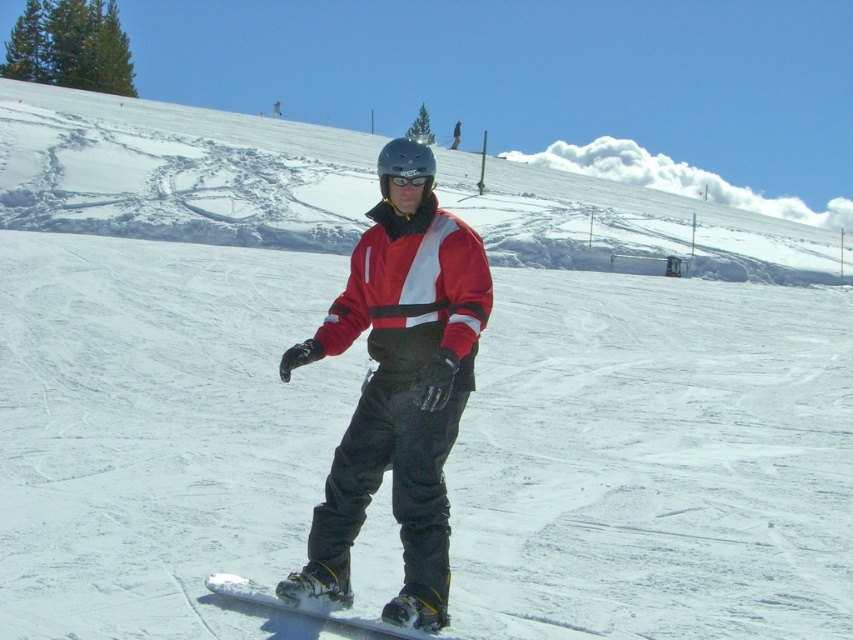
Question: Estimate the real-world distances between objects in this image. Which object is closer to the transparent plastic goggles at center?

Choices:
 (A) white matte snowboard at center
 (B) matte red snowboarder at center

Answer: (B)

Question: Which point is farther from the camera taking this photo?

Choices:
 (A) (392, 509)
 (B) (328, 605)
 (C) (427, 186)

Answer: (A)

Question: Where is matte red snowboarder at center located in relation to transparent plastic goggles at center in the image?

Choices:
 (A) below
 (B) above

Answer: (A)

Question: Considering the relative positions of matte red snowboarder at center and transparent plastic goggles at center in the image provided, where is matte red snowboarder at center located with respect to transparent plastic goggles at center?

Choices:
 (A) right
 (B) left

Answer: (B)

Question: Can you confirm if white matte snowboard at center is positioned below transparent plastic goggles at center?

Choices:
 (A) no
 (B) yes

Answer: (B)

Question: Among these points, which one is nearest to the camera?

Choices:
 (A) (422, 632)
 (B) (421, 180)
 (C) (311, 541)

Answer: (A)